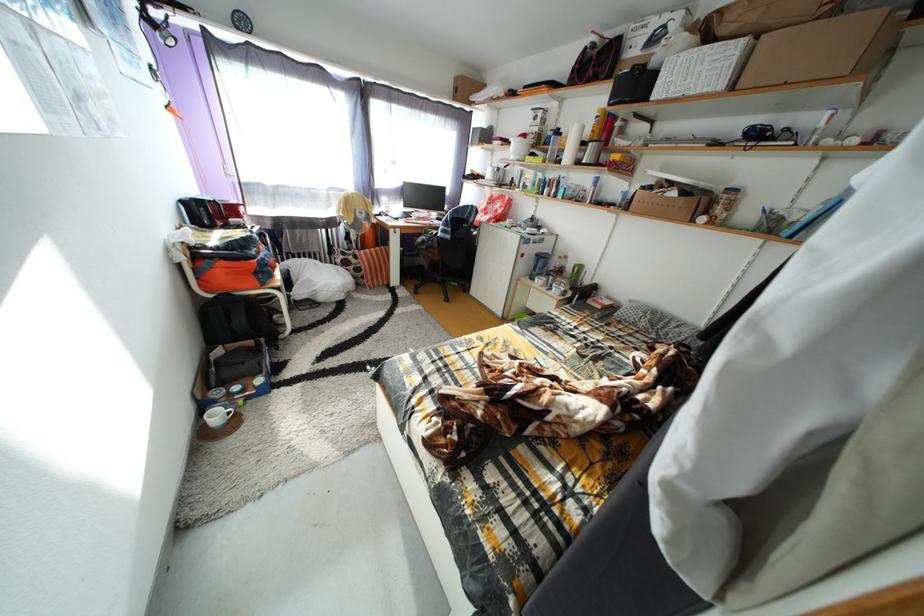
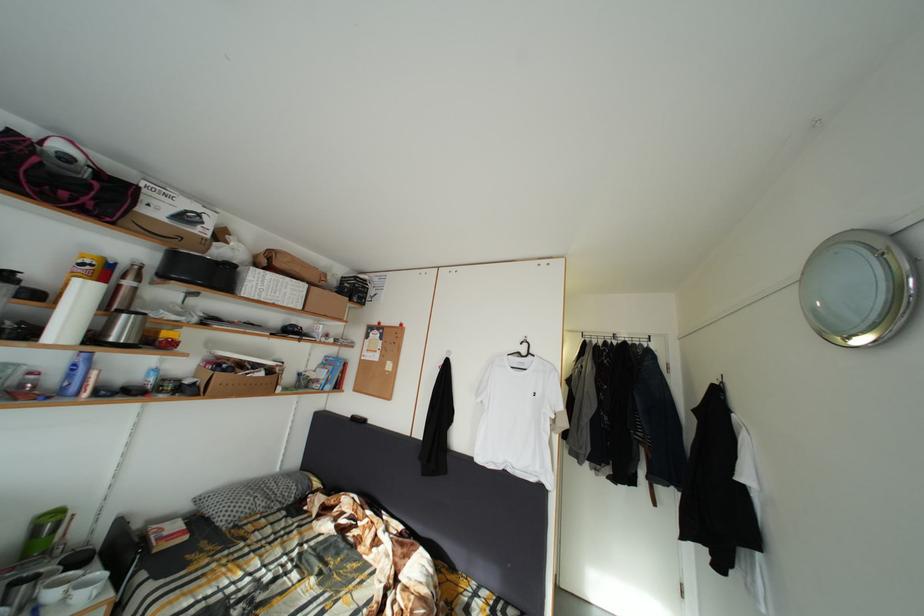
Find the pixel in the second image that matches point 679,191 in the first image.

(264, 373)